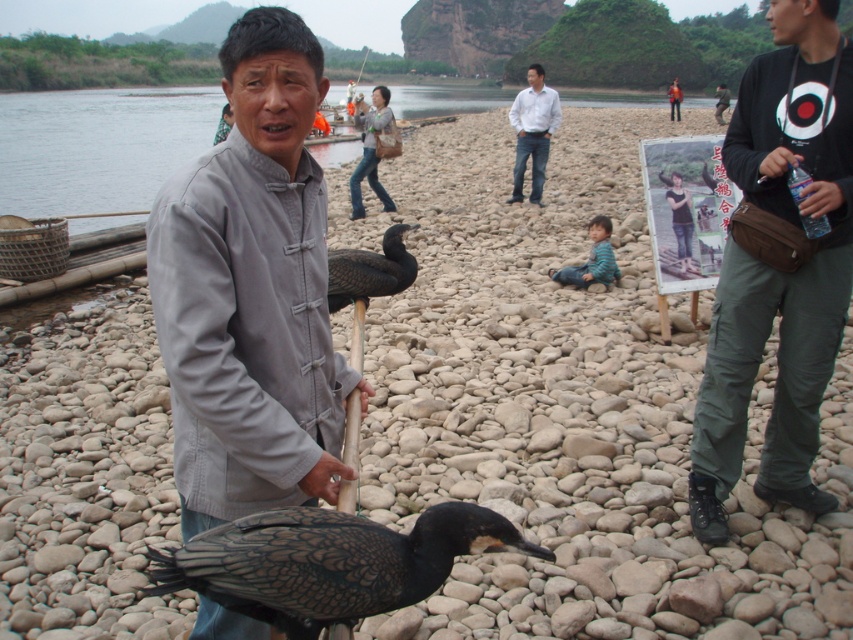
Can you confirm if gray matte jacket at center is shorter than dark green jacket at center?

Indeed, gray matte jacket at center has a lesser height compared to dark green jacket at center.

Which is below, gray matte jacket at center or dark green jacket at center?

A: Positioned lower is gray matte jacket at center.

The height and width of the screenshot is (640, 853). Describe the element at coordinates (251, 292) in the screenshot. I see `gray matte jacket at center` at that location.

This screenshot has height=640, width=853. Find the location of `gray matte jacket at center`. gray matte jacket at center is located at coordinates (x=251, y=292).

Is point (735, 346) farther from viewer compared to point (721, 93)?

No, it is in front of (721, 93).

Is black cotton shirt at right above dark green jacket at center?

Actually, black cotton shirt at right is below dark green jacket at center.

Between point (784, 209) and point (717, 115), which one is positioned behind?

The point (717, 115) is more distant.

What are the coordinates of `black cotton shirt at right` in the screenshot? It's located at (779, 264).

Can you confirm if black cotton shirt at right is taller than light blue shirt at center?

No.

Does black cotton shirt at right lie in front of light blue shirt at center?

Yes, it is.

Where is `black cotton shirt at right`? black cotton shirt at right is located at coordinates (779, 264).